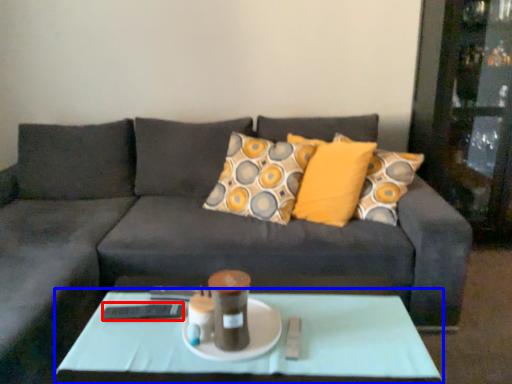
Question: Which point is further to the camera, remote (highlighted by a red box) or coffee table (highlighted by a blue box)?

Choices:
 (A) remote
 (B) coffee table

Answer: (A)